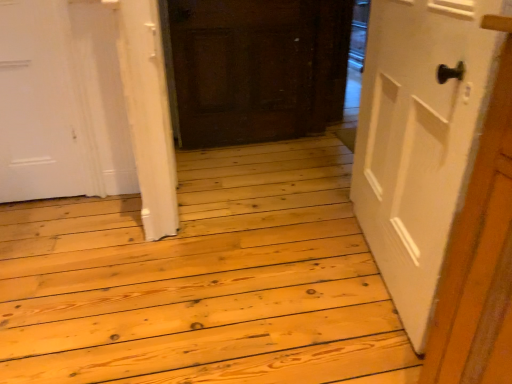
What do you see at coordinates (419, 138) in the screenshot?
I see `white matte door at right, the second door from the back` at bounding box center [419, 138].

I want to click on white matte door at right, which is counted as the second door, starting from the left, so click(419, 138).

Where is `dark brown wood door at center, placed as the second door when sorted from right to left`? The width and height of the screenshot is (512, 384). dark brown wood door at center, placed as the second door when sorted from right to left is located at coordinates (257, 68).

What do you see at coordinates (257, 68) in the screenshot? I see `dark brown wood door at center, placed as the second door when sorted from front to back` at bounding box center [257, 68].

Locate an element on the screen. The image size is (512, 384). white matte door at right, acting as the 1th door starting from the front is located at coordinates (419, 138).

Based on their positions, is dark brown wood door at center, the 1th door viewed from the left, located to the left or right of white matte door at right, which is the 1th door in right-to-left order?

dark brown wood door at center, the 1th door viewed from the left, is positioned on white matte door at right, which is the 1th door in right-to-left order,'s left side.

Relative to white matte door at right, which is counted as the second door, starting from the left, is dark brown wood door at center, which is counted as the 1th door, starting from the back, in front or behind?

dark brown wood door at center, which is counted as the 1th door, starting from the back, is positioned farther from the viewer than white matte door at right, which is counted as the second door, starting from the left.

Does point (290, 63) appear closer or farther from the camera than point (401, 220)?

Clearly, point (290, 63) is more distant from the camera than point (401, 220).

From the image's perspective, is dark brown wood door at center, placed as the second door when sorted from front to back, located above white matte door at right, the second door from the back?

Correct, dark brown wood door at center, placed as the second door when sorted from front to back, appears higher than white matte door at right, the second door from the back, in the image.

From the picture: From a real-world perspective, which is physically above, dark brown wood door at center, the 1th door viewed from the left, or white matte door at right, which is counted as the second door, starting from the left?

From a 3D spatial view, white matte door at right, which is counted as the second door, starting from the left, is above.

Considering the sizes of objects dark brown wood door at center, the 1th door viewed from the left, and white matte door at right, the second door from the back, in the image provided, who is wider, dark brown wood door at center, the 1th door viewed from the left, or white matte door at right, the second door from the back,?

white matte door at right, the second door from the back, is wider.

Does dark brown wood door at center, which is counted as the 1th door, starting from the back, have a greater height compared to white matte door at right, the second door from the back?

No.

Does dark brown wood door at center, which is counted as the 1th door, starting from the back, have a larger size compared to white matte door at right, which is counted as the second door, starting from the left?

Actually, dark brown wood door at center, which is counted as the 1th door, starting from the back, might be smaller than white matte door at right, which is counted as the second door, starting from the left.

Can we say dark brown wood door at center, the 1th door viewed from the left, lies outside white matte door at right, which is counted as the second door, starting from the left?

Yes, dark brown wood door at center, the 1th door viewed from the left, is not within white matte door at right, which is counted as the second door, starting from the left.

Is the surface of dark brown wood door at center, the 1th door viewed from the left, in direct contact with white matte door at right, which is counted as the second door, starting from the left?

There is a gap between dark brown wood door at center, the 1th door viewed from the left, and white matte door at right, which is counted as the second door, starting from the left.

Could you tell me if dark brown wood door at center, which is counted as the 1th door, starting from the back, is turned towards white matte door at right, acting as the 1th door starting from the front?

Yes, dark brown wood door at center, which is counted as the 1th door, starting from the back, is aimed at white matte door at right, acting as the 1th door starting from the front.

This screenshot has width=512, height=384. In order to click on door below the dark brown wood door at center, placed as the second door when sorted from front to back (from the image's perspective) in this screenshot , I will do `click(419, 138)`.

Looking at this image, can you confirm if white matte door at right, acting as the 1th door starting from the front, is positioned to the right of dark brown wood door at center, which is counted as the 1th door, starting from the back?

Correct, you'll find white matte door at right, acting as the 1th door starting from the front, to the right of dark brown wood door at center, which is counted as the 1th door, starting from the back.

Does white matte door at right, the second door from the back, lie in front of dark brown wood door at center, placed as the second door when sorted from right to left?

Yes, it is.

Is point (380, 237) behind point (209, 10)?

No, (380, 237) is closer to viewer.

From the image's perspective, is white matte door at right, which is counted as the second door, starting from the left, above dark brown wood door at center, placed as the second door when sorted from right to left?

No, from the image's perspective, white matte door at right, which is counted as the second door, starting from the left, is not over dark brown wood door at center, placed as the second door when sorted from right to left.

From a real-world perspective, is white matte door at right, which is counted as the second door, starting from the left, positioned above or below dark brown wood door at center, placed as the second door when sorted from right to left?

Clearly, from a real-world perspective, white matte door at right, which is counted as the second door, starting from the left, is above dark brown wood door at center, placed as the second door when sorted from right to left.

Considering the relative sizes of white matte door at right, which is counted as the second door, starting from the left, and dark brown wood door at center, which is counted as the 1th door, starting from the back, in the image provided, is white matte door at right, which is counted as the second door, starting from the left, wider than dark brown wood door at center, which is counted as the 1th door, starting from the back,?

Correct, the width of white matte door at right, which is counted as the second door, starting from the left, exceeds that of dark brown wood door at center, which is counted as the 1th door, starting from the back.

Does white matte door at right, which is counted as the second door, starting from the left, have a lesser height compared to dark brown wood door at center, placed as the second door when sorted from right to left?

No.

Considering the sizes of objects white matte door at right, which is the 1th door in right-to-left order, and dark brown wood door at center, the 1th door viewed from the left, in the image provided, who is smaller, white matte door at right, which is the 1th door in right-to-left order, or dark brown wood door at center, the 1th door viewed from the left,?

With smaller size is dark brown wood door at center, the 1th door viewed from the left.

Would you say white matte door at right, which is the 1th door in right-to-left order, contains dark brown wood door at center, which is counted as the 1th door, starting from the back?

That's incorrect, dark brown wood door at center, which is counted as the 1th door, starting from the back, is not inside white matte door at right, which is the 1th door in right-to-left order.

Are white matte door at right, the second door from the back, and dark brown wood door at center, placed as the second door when sorted from right to left, located far from each other?

That's right, there is a large distance between white matte door at right, the second door from the back, and dark brown wood door at center, placed as the second door when sorted from right to left.

Is white matte door at right, the second door from the back, turned away from dark brown wood door at center, the 1th door viewed from the left?

No, dark brown wood door at center, the 1th door viewed from the left, is not at the back of white matte door at right, the second door from the back.

Locate an element on the screen. door above the dark brown wood door at center, placed as the second door when sorted from front to back (from a real-world perspective) is located at coordinates (419, 138).

The width and height of the screenshot is (512, 384). In order to click on door lying on the left of white matte door at right, which is counted as the second door, starting from the left in this screenshot , I will do `click(257, 68)`.

Find the location of a particular element. door that appears behind the white matte door at right, the second door from the back is located at coordinates (257, 68).